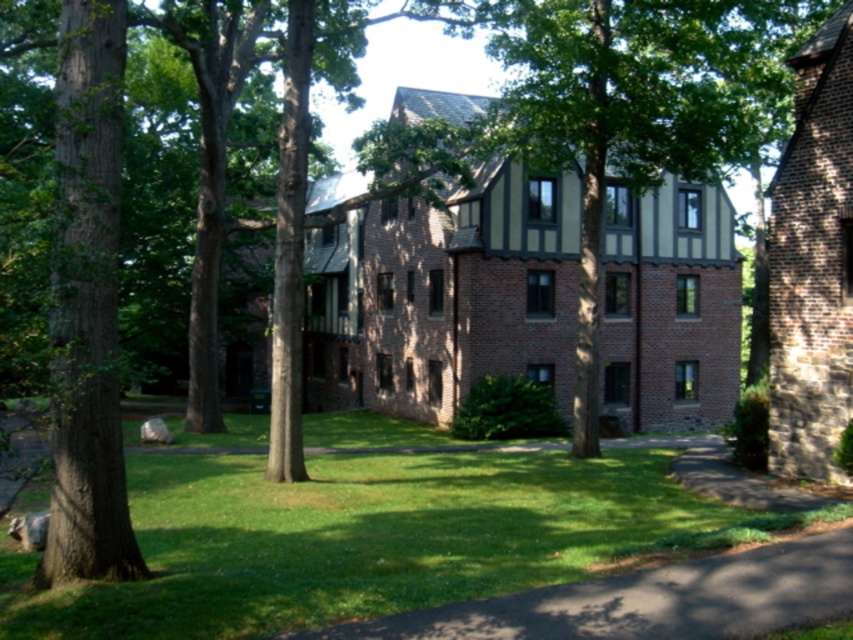
Is green grass at center further to camera compared to green grass at lower center?

Yes, green grass at center is further from the viewer.

At what (x,y) coordinates should I click in order to perform the action: click on green grass at center. Please return your answer as a coordinate pair (x, y). This screenshot has height=640, width=853. Looking at the image, I should click on (364, 540).

You are a GUI agent. You are given a task and a screenshot of the screen. Output one action in this format:
    pyautogui.click(x=<x>, y=<y>)
    Task: Click on the green grass at center
    
    Given the screenshot: What is the action you would take?
    pyautogui.click(x=364, y=540)